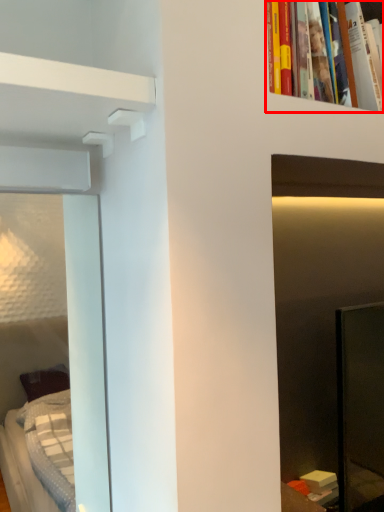
Question: From the image's perspective, what is the correct spatial relationship of book (annotated by the red box) in relation to shelf?

Choices:
 (A) above
 (B) below

Answer: (A)